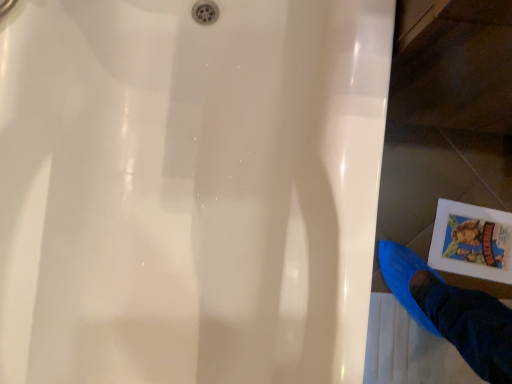
Measure the distance between point (458, 291) and camera.

The depth of point (458, 291) is 3.76 feet.

This screenshot has width=512, height=384. What do you see at coordinates (452, 312) in the screenshot? I see `blue fabric foot at lower right` at bounding box center [452, 312].

Where is `blue fabric foot at lower right`? The image size is (512, 384). blue fabric foot at lower right is located at coordinates (452, 312).

This screenshot has height=384, width=512. I want to click on white paper comic book at lower right, so click(x=472, y=241).

Measure the distance between white paper comic book at lower right and camera.

The distance of white paper comic book at lower right from camera is 1.28 meters.

The image size is (512, 384). Describe the element at coordinates (472, 241) in the screenshot. I see `white paper comic book at lower right` at that location.

Identify the location of blue fabric foot at lower right. The image size is (512, 384). (452, 312).

Does white paper comic book at lower right appear on the left side of blue fabric foot at lower right?

In fact, white paper comic book at lower right is to the right of blue fabric foot at lower right.

Is white paper comic book at lower right positioned in front of blue fabric foot at lower right?

No, white paper comic book at lower right is behind blue fabric foot at lower right.

Considering the positions of points (462, 268) and (457, 339), is point (462, 268) closer to camera compared to point (457, 339)?

No, (462, 268) is behind (457, 339).

From the image's perspective, relative to blue fabric foot at lower right, is white paper comic book at lower right above or below?

Based on their image positions, white paper comic book at lower right is located above blue fabric foot at lower right.

From a real-world perspective, which is physically below, white paper comic book at lower right or blue fabric foot at lower right?

white paper comic book at lower right.

Which of these two, white paper comic book at lower right or blue fabric foot at lower right, is wider?

blue fabric foot at lower right.

Can you confirm if white paper comic book at lower right is shorter than blue fabric foot at lower right?

No.

Looking at the image, does white paper comic book at lower right seem bigger or smaller compared to blue fabric foot at lower right?

Considering their sizes, white paper comic book at lower right takes up less space than blue fabric foot at lower right.

Would you say blue fabric foot at lower right is part of white paper comic book at lower right's contents?

That's incorrect, blue fabric foot at lower right is not inside white paper comic book at lower right.

Would you consider white paper comic book at lower right to be distant from blue fabric foot at lower right?

No, white paper comic book at lower right is not far away from blue fabric foot at lower right.

Is white paper comic book at lower right turned away from blue fabric foot at lower right?

white paper comic book at lower right is not turned away from blue fabric foot at lower right.

What's the angular difference between white paper comic book at lower right and blue fabric foot at lower right's facing directions?

The facing directions of white paper comic book at lower right and blue fabric foot at lower right are 96.5 degrees apart.

Image resolution: width=512 pixels, height=384 pixels. I want to click on comic book located on the right of blue fabric foot at lower right, so click(x=472, y=241).

In the scene shown: In the image, is blue fabric foot at lower right on the left side or the right side of white paper comic book at lower right?

Based on their positions, blue fabric foot at lower right is located to the left of white paper comic book at lower right.

Is blue fabric foot at lower right behind white paper comic book at lower right?

No, it is not.

Which is closer to the camera, (399, 289) or (498, 217)?

The point (399, 289) is closer.

From the image's perspective, is blue fabric foot at lower right below white paper comic book at lower right?

Yes, from the image's perspective, blue fabric foot at lower right is beneath white paper comic book at lower right.

Based on the photo, from a real-world perspective, is blue fabric foot at lower right over white paper comic book at lower right?

Yes, from a real-world perspective, blue fabric foot at lower right is above white paper comic book at lower right.

Which object is thinner, blue fabric foot at lower right or white paper comic book at lower right?

white paper comic book at lower right is thinner.

Can you confirm if blue fabric foot at lower right is shorter than white paper comic book at lower right?

Yes.

Considering the sizes of objects blue fabric foot at lower right and white paper comic book at lower right in the image provided, who is bigger, blue fabric foot at lower right or white paper comic book at lower right?

blue fabric foot at lower right.

Based on the photo, choose the correct answer: Is blue fabric foot at lower right inside white paper comic book at lower right or outside it?

blue fabric foot at lower right cannot be found inside white paper comic book at lower right.

Is there a large distance between blue fabric foot at lower right and white paper comic book at lower right?

No.

Is blue fabric foot at lower right aimed at white paper comic book at lower right?

No, blue fabric foot at lower right is not oriented towards white paper comic book at lower right.

In the scene shown: What's the angular difference between blue fabric foot at lower right and white paper comic book at lower right's facing directions?

The angular difference between blue fabric foot at lower right and white paper comic book at lower right is 96.5 degrees.

At what (x,y) coordinates should I click in order to perform the action: click on person on the left side of white paper comic book at lower right. Please return your answer as a coordinate pair (x, y). The image size is (512, 384). Looking at the image, I should click on (452, 312).

Find the location of a particular element. comic book lying on the right of blue fabric foot at lower right is located at coordinates (472, 241).

Where is `person above the white paper comic book at lower right (from a real-world perspective)`? person above the white paper comic book at lower right (from a real-world perspective) is located at coordinates (452, 312).